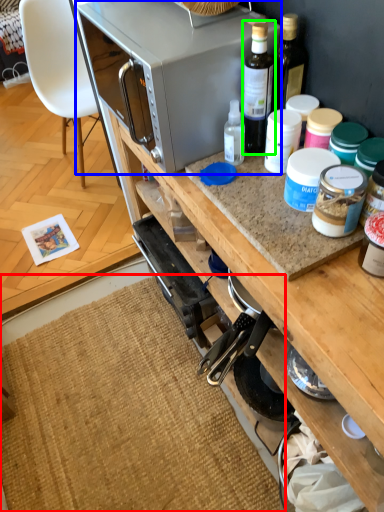
Question: Which is farther away from mat (highlighted by a red box)? microwave oven (highlighted by a blue box) or bottle (highlighted by a green box)?

Choices:
 (A) microwave oven
 (B) bottle

Answer: (B)